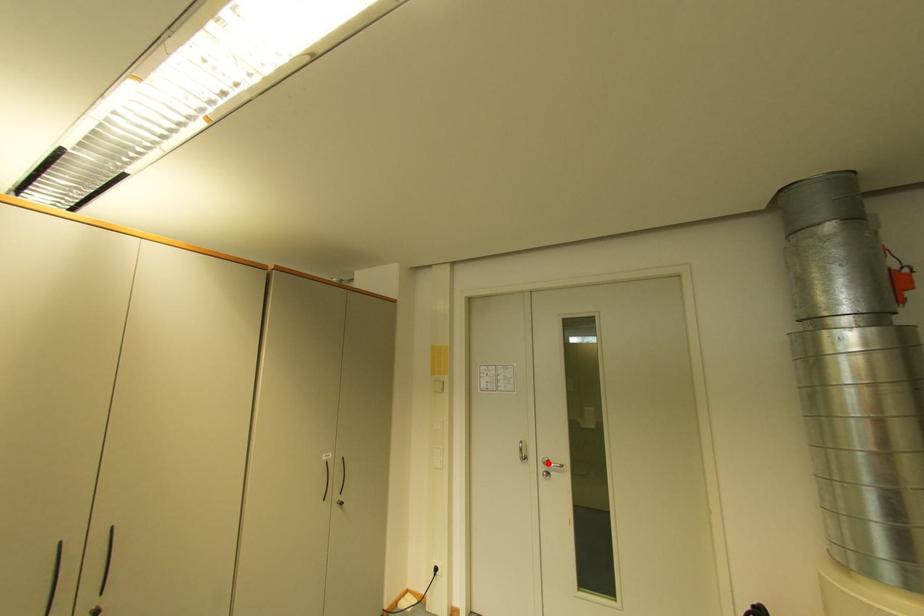
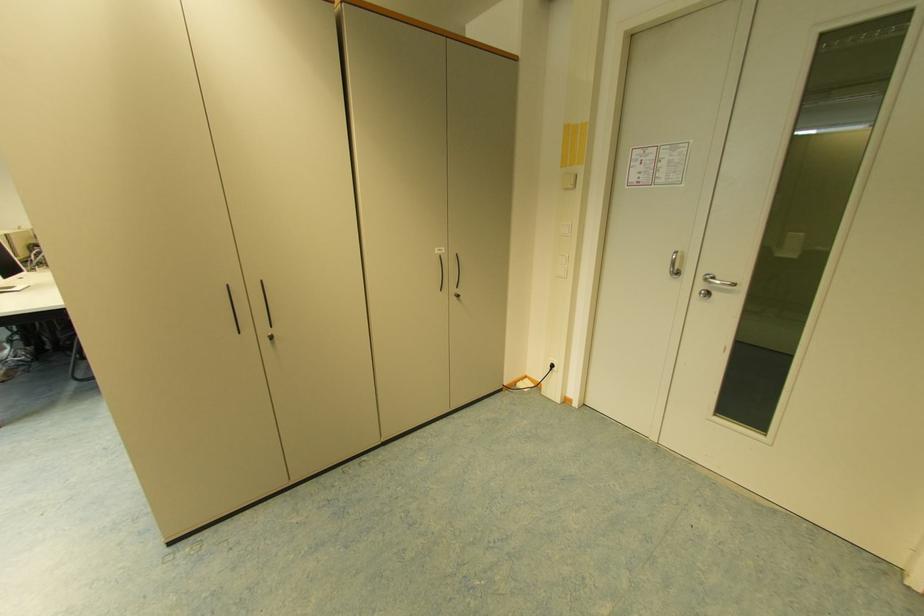
Question: I am providing you with two images of the same scene from different viewpoints. Image1 has a red point marked. In image2, the corresponding 3D location appears at what relative position? Reply with the corresponding letter.

Choices:
 (A) Closer
 (B) Farther

Answer: (A)